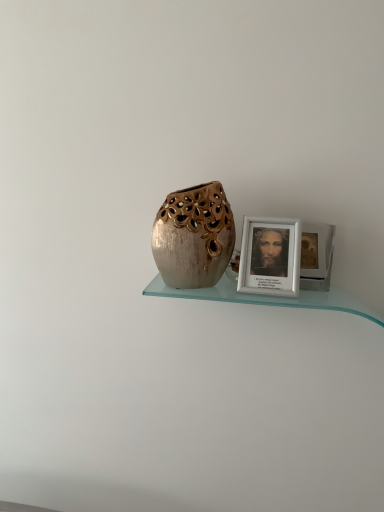
Where is `shiny metallic vase at center`? shiny metallic vase at center is located at coordinates (194, 236).

This screenshot has width=384, height=512. What do you see at coordinates (194, 236) in the screenshot?
I see `shiny metallic vase at center` at bounding box center [194, 236].

The width and height of the screenshot is (384, 512). What do you see at coordinates (270, 257) in the screenshot?
I see `white matte picture frame at upper right` at bounding box center [270, 257].

The height and width of the screenshot is (512, 384). What are the coordinates of `white matte picture frame at upper right` in the screenshot? It's located at (270, 257).

Locate an element on the screen. Image resolution: width=384 pixels, height=512 pixels. shiny metallic vase at center is located at coordinates tap(194, 236).

Between white matte picture frame at upper right and shiny metallic vase at center, which one appears on the right side from the viewer's perspective?

Positioned to the right is white matte picture frame at upper right.

Which object is further away from the camera taking this photo, white matte picture frame at upper right or shiny metallic vase at center?

white matte picture frame at upper right is behind.

Does point (277, 247) come in front of point (218, 239)?

No, (277, 247) is behind (218, 239).

From the image's perspective, who appears lower, white matte picture frame at upper right or shiny metallic vase at center?

white matte picture frame at upper right appears lower in the image.

From a real-world perspective, is white matte picture frame at upper right below shiny metallic vase at center?

Yes.

Looking at their sizes, would you say white matte picture frame at upper right is wider or thinner than shiny metallic vase at center?

Clearly, white matte picture frame at upper right has less width compared to shiny metallic vase at center.

From the picture: Considering the sizes of objects white matte picture frame at upper right and shiny metallic vase at center in the image provided, who is taller, white matte picture frame at upper right or shiny metallic vase at center?

shiny metallic vase at center is taller.

Between white matte picture frame at upper right and shiny metallic vase at center, which one has larger size?

Bigger between the two is shiny metallic vase at center.

Is white matte picture frame at upper right positioned beyond the bounds of shiny metallic vase at center?

Yes, white matte picture frame at upper right is outside of shiny metallic vase at center.

Is white matte picture frame at upper right next to shiny metallic vase at center?

No.

Could you tell me if white matte picture frame at upper right is turned towards shiny metallic vase at center?

No, white matte picture frame at upper right is not facing towards shiny metallic vase at center.

How much distance is there between white matte picture frame at upper right and shiny metallic vase at center?

They are 3.98 inches apart.

Identify the location of vase on the left side of white matte picture frame at upper right. This screenshot has width=384, height=512. (194, 236).

Based on the photo, between shiny metallic vase at center and white matte picture frame at upper right, which one appears on the right side from the viewer's perspective?

white matte picture frame at upper right.

Which is behind, shiny metallic vase at center or white matte picture frame at upper right?

white matte picture frame at upper right.

Does point (221, 196) lie in front of point (256, 261)?

No.

From the image's perspective, relative to white matte picture frame at upper right, is shiny metallic vase at center above or below?

shiny metallic vase at center is above white matte picture frame at upper right.

From a real-world perspective, is shiny metallic vase at center under white matte picture frame at upper right?

No, from a real-world perspective, shiny metallic vase at center is not beneath white matte picture frame at upper right.

Considering the relative sizes of shiny metallic vase at center and white matte picture frame at upper right in the image provided, is shiny metallic vase at center thinner than white matte picture frame at upper right?

No.

Can you confirm if shiny metallic vase at center is shorter than white matte picture frame at upper right?

In fact, shiny metallic vase at center may be taller than white matte picture frame at upper right.

Based on their sizes in the image, would you say shiny metallic vase at center is bigger or smaller than white matte picture frame at upper right?

Considering their sizes, shiny metallic vase at center takes up more space than white matte picture frame at upper right.

Can white matte picture frame at upper right be found inside shiny metallic vase at center?

That's incorrect, white matte picture frame at upper right is not inside shiny metallic vase at center.

Is shiny metallic vase at center far from white matte picture frame at upper right?

No, shiny metallic vase at center is not far from white matte picture frame at upper right.

Is shiny metallic vase at center positioned with its back to white matte picture frame at upper right?

That's not correct — shiny metallic vase at center is not looking away from white matte picture frame at upper right.

Can you tell me how much shiny metallic vase at center and white matte picture frame at upper right differ in facing direction?

shiny metallic vase at center and white matte picture frame at upper right are facing 0.000109 degrees away from each other.

Measure the distance from shiny metallic vase at center to white matte picture frame at upper right.

shiny metallic vase at center and white matte picture frame at upper right are 3.98 inches apart from each other.

The width and height of the screenshot is (384, 512). What are the coordinates of `picture frame on the right of shiny metallic vase at center` in the screenshot? It's located at (x=270, y=257).

Find the location of `vase in front of the white matte picture frame at upper right`. vase in front of the white matte picture frame at upper right is located at coordinates (194, 236).

Where is `picture frame behind the shiny metallic vase at center`? Image resolution: width=384 pixels, height=512 pixels. picture frame behind the shiny metallic vase at center is located at coordinates (270, 257).